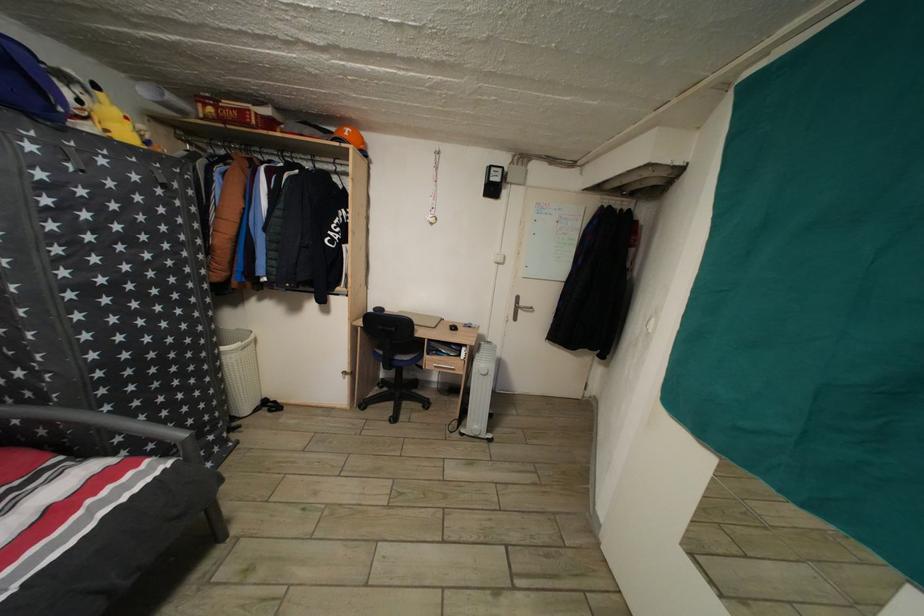
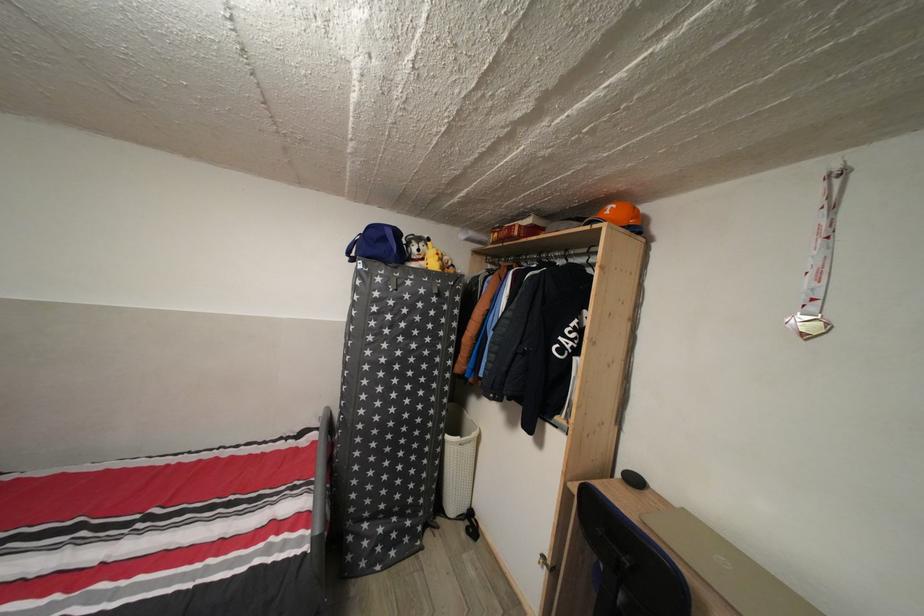
Locate, in the second image, the point that corresponds to point (440, 217) in the first image.

(820, 314)